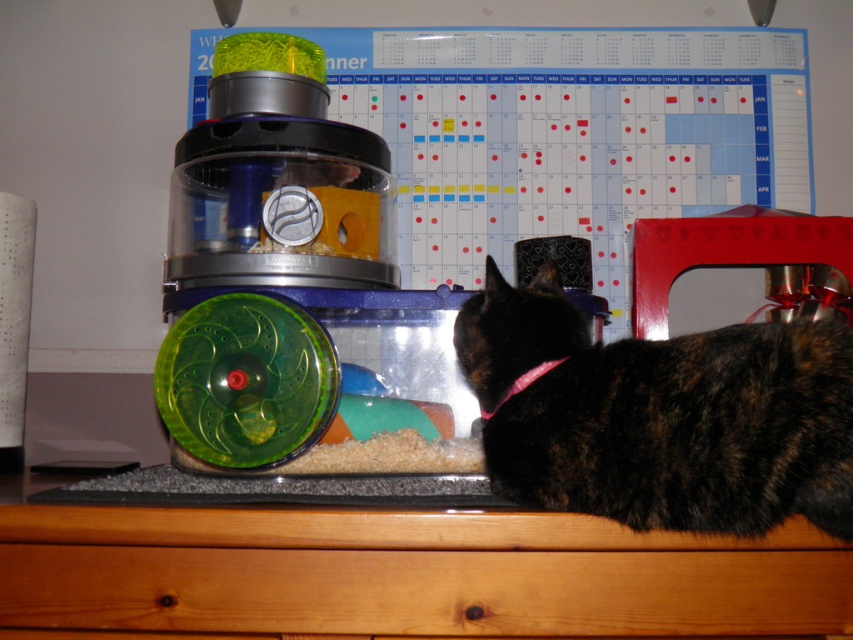
You are a cat owner who wants to place a new toy for your cat. The wooden drawer at lower center and the tortoiseshell fur at right are in the scene. Which location is closer to you where you can place the toy so the cat can easily reach it?

The wooden drawer at lower center is closer to you than the tortoiseshell fur at right, so placing the toy there would be easier for the cat to reach.

You are a small toy mouse that is 2 inches long. You want to roll from the wooden drawer at lower center to the tortoiseshell fur at right. Can you fit through the space between them?

The wooden drawer at lower center and tortoiseshell fur at right are 5.32 inches apart. Since the toy mouse is only 2 inches long, it can easily fit through the space between them.